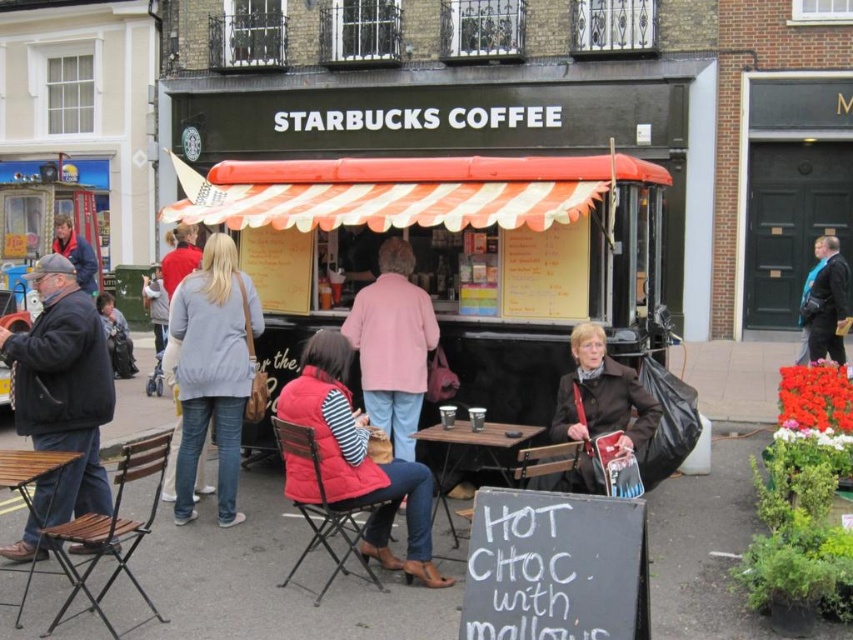
What do you see at coordinates (213, 371) in the screenshot? I see `light gray cotton jacket at center` at bounding box center [213, 371].

Which of these two, light gray cotton jacket at center or wooden table at center, stands shorter?

wooden table at center is shorter.

The image size is (853, 640). Identify the location of light gray cotton jacket at center. (213, 371).

Who is lower down, dark blue jacket at left or metallic silver cart at left?

metallic silver cart at left is lower down.

What do you see at coordinates (61, 400) in the screenshot?
I see `dark blue jacket at left` at bounding box center [61, 400].

This screenshot has width=853, height=640. Identify the location of dark blue jacket at left. tap(61, 400).

Does light gray cotton jacket at center have a greater height compared to metallic silver cart at left?

Yes.

Between point (202, 321) and point (59, 216), which one is positioned in front?

Point (202, 321) is in front.

Where is `light gray cotton jacket at center`? light gray cotton jacket at center is located at coordinates (213, 371).